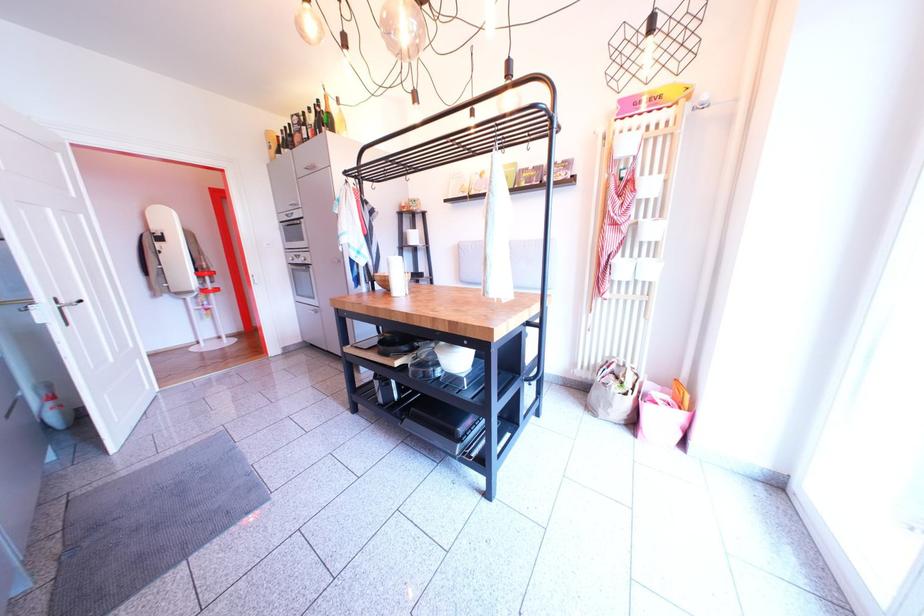
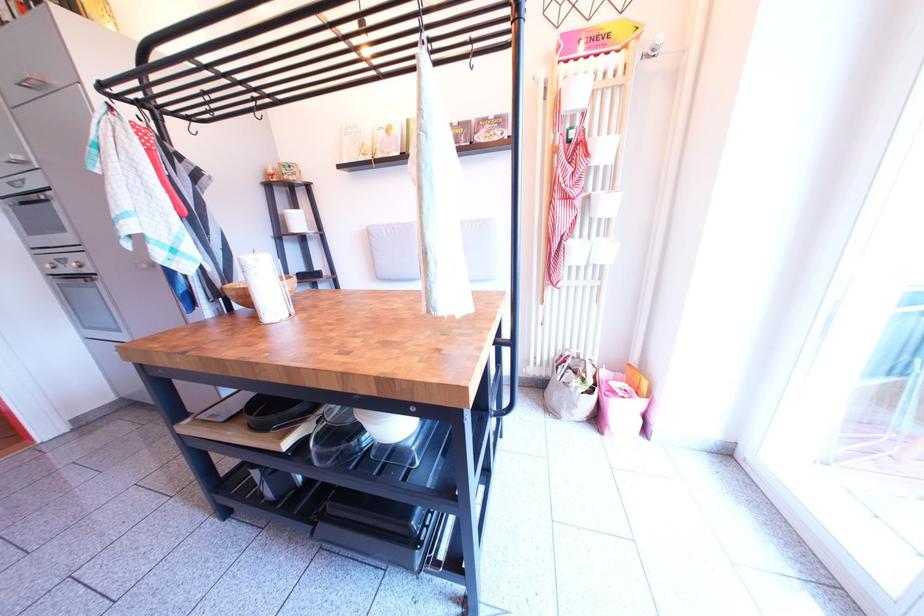
Locate, in the second image, the point that corresponds to (387,284) in the first image.

(239, 299)